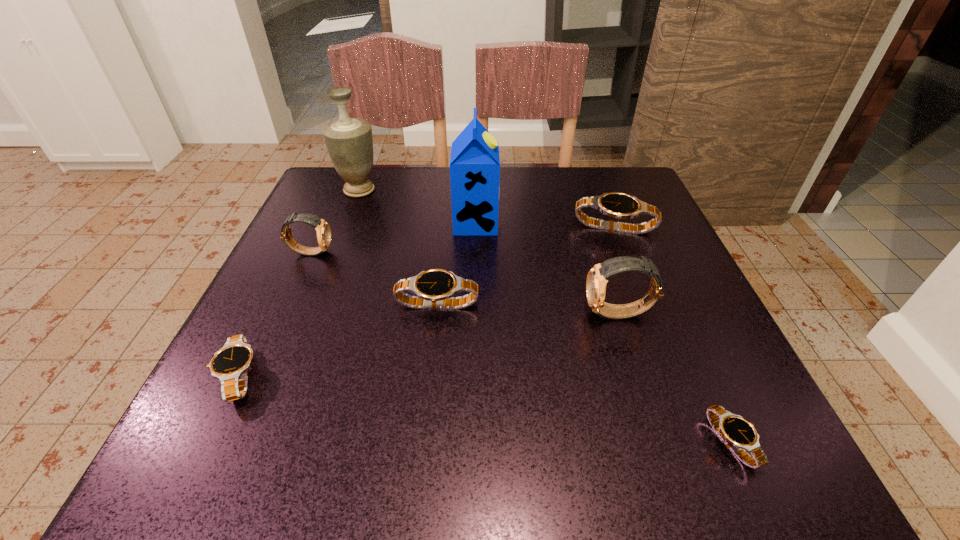
Identify the location of empty space that is in between the fifth farthest watch and the fourth farthest object. This screenshot has height=540, width=960. (276, 314).

In order to click on unoccupied position between the left gold watch and the nearest black watch in this screenshot , I will do `click(520, 347)`.

Identify the location of unoccupied area between the leftmost black watch and the third shortest object. The width and height of the screenshot is (960, 540). (339, 341).

You are a GUI agent. You are given a task and a screenshot of the screen. Output one action in this format:
    pyautogui.click(x=<x>, y=<y>)
    Task: Click on the free space between the nearest black watch and the second biggest black watch
    
    Given the screenshot: What is the action you would take?
    pyautogui.click(x=584, y=374)

Locate an element on the screen. The image size is (960, 540). free point between the blue carton and the nearest object is located at coordinates (603, 332).

You are a GUI agent. You are given a task and a screenshot of the screen. Output one action in this format:
    pyautogui.click(x=<x>, y=<y>)
    Task: Click on the free spot between the carton and the smaller gold watch
    This screenshot has width=960, height=540.
    Given the screenshot: What is the action you would take?
    pyautogui.click(x=394, y=237)

At what (x,y) coordinates should I click in order to perform the action: click on the seventh closest object to the second tallest watch. Please return your answer as a coordinate pair (x, y). Looking at the image, I should click on (739, 434).

Where is `object that can be found as the closest to the carton`? The image size is (960, 540). object that can be found as the closest to the carton is located at coordinates (618, 205).

Locate which watch ranks third in proximity to the fifth tallest object. Please provide its 2D coordinates. Your answer should be formatted as a tuple, i.e. [(x, y)], where the tuple contains the x and y coordinates of a point satisfying the conditions above.

[(739, 434)]

Point out which watch is positioned as the fifth nearest to the third smallest black watch. Please provide its 2D coordinates. Your answer should be formatted as a tuple, i.e. [(x, y)], where the tuple contains the x and y coordinates of a point satisfying the conditions above.

[(739, 434)]